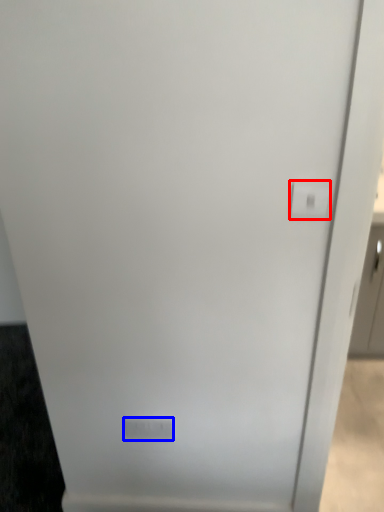
Question: Among these objects, which one is farthest to the camera, light switch (highlighted by a red box) or light switch (highlighted by a blue box)?

Choices:
 (A) light switch
 (B) light switch

Answer: (B)